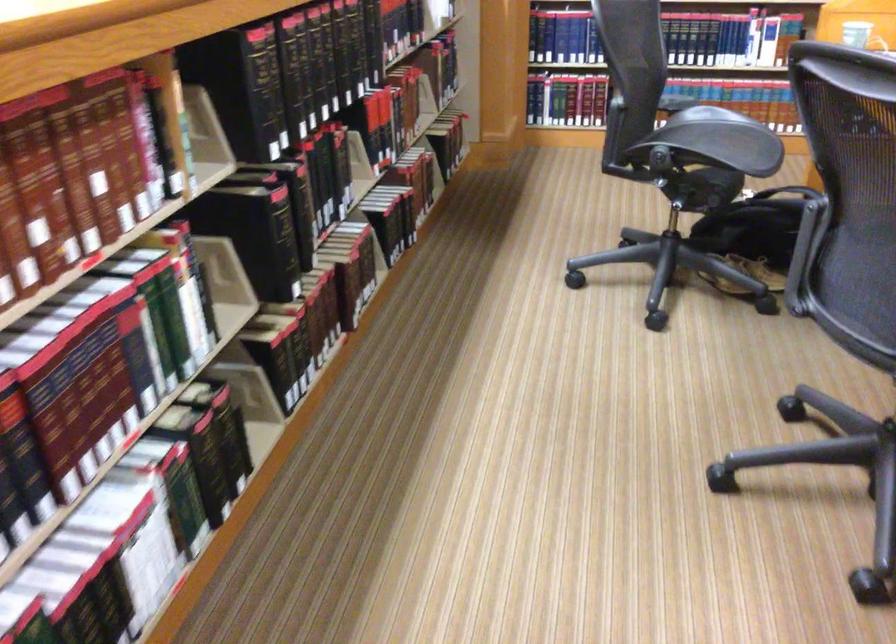
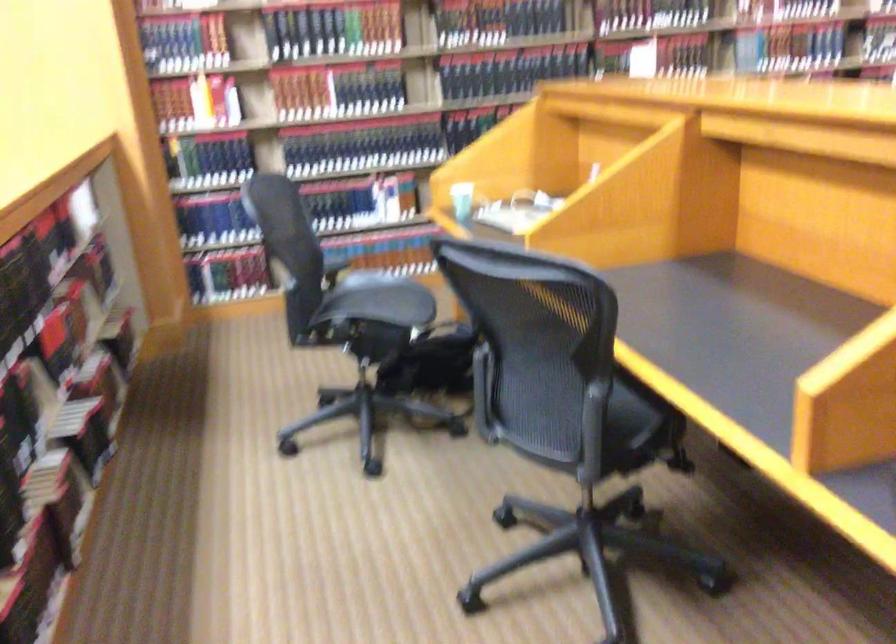
In a continuous first-person perspective shot, in which direction is the camera moving?

The cameraman walked toward left, backward.